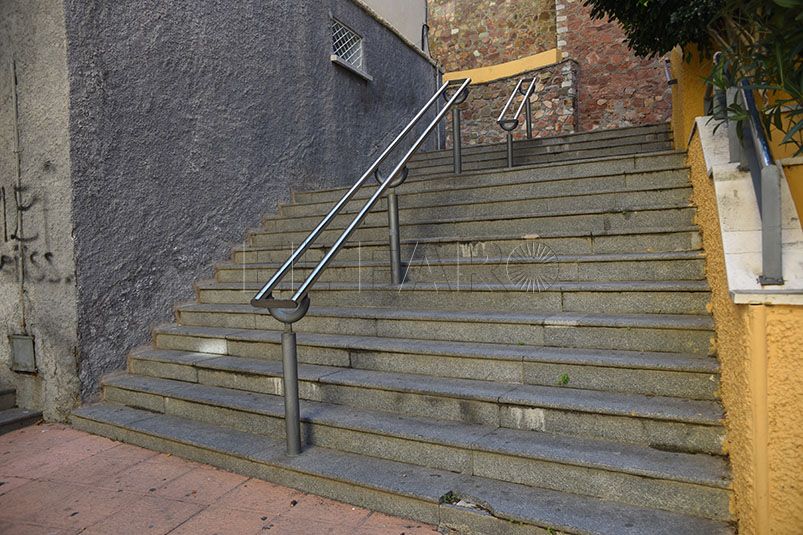
The width and height of the screenshot is (803, 535). I want to click on stair rails, so click(x=761, y=146), click(x=712, y=67), click(x=669, y=74), click(x=523, y=100), click(x=504, y=102), click(x=433, y=123), click(x=406, y=124).